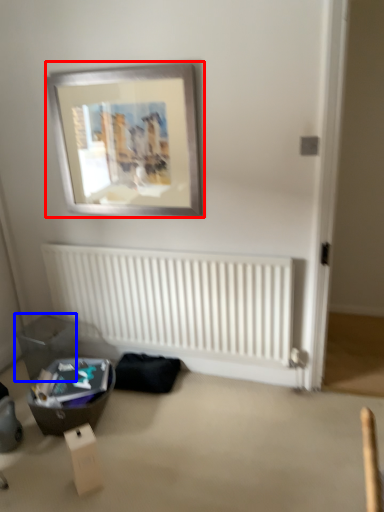
Question: Which of the following is the farthest to the observer, picture frame (highlighted by a red box) or storage box (highlighted by a blue box)?

Choices:
 (A) picture frame
 (B) storage box

Answer: (B)